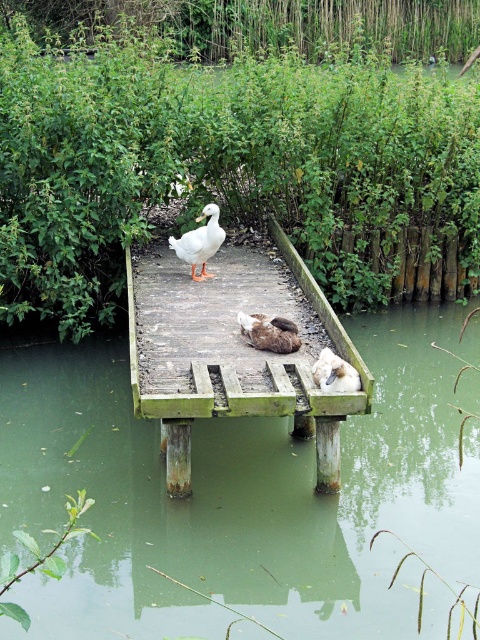
Does point (205, 257) come closer to viewer compared to point (285, 340)?

No, it is behind (285, 340).

Does point (202, 259) come in front of point (292, 346)?

No, (202, 259) is further to viewer.

Identify the location of white matte duck at center. (200, 241).

Is greenish murky water at center positioned in front of white matte duck at center?

Yes, greenish murky water at center is in front of white matte duck at center.

What do you see at coordinates (243, 496) in the screenshot? I see `greenish murky water at center` at bounding box center [243, 496].

I want to click on greenish murky water at center, so click(243, 496).

Between point (334, 589) and point (274, 349), which one is positioned in front?

Point (334, 589) is in front.

Can you confirm if greenish murky water at center is bigger than brown fuzzy duck at center?

Indeed, greenish murky water at center has a larger size compared to brown fuzzy duck at center.

This screenshot has height=640, width=480. What do you see at coordinates (243, 496) in the screenshot?
I see `greenish murky water at center` at bounding box center [243, 496].

The height and width of the screenshot is (640, 480). In order to click on greenish murky water at center in this screenshot , I will do `click(243, 496)`.